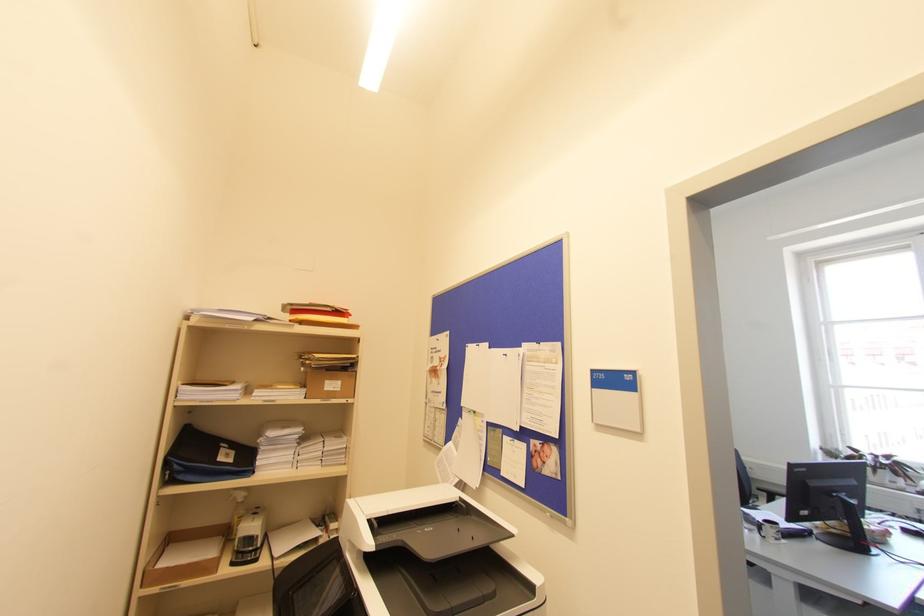
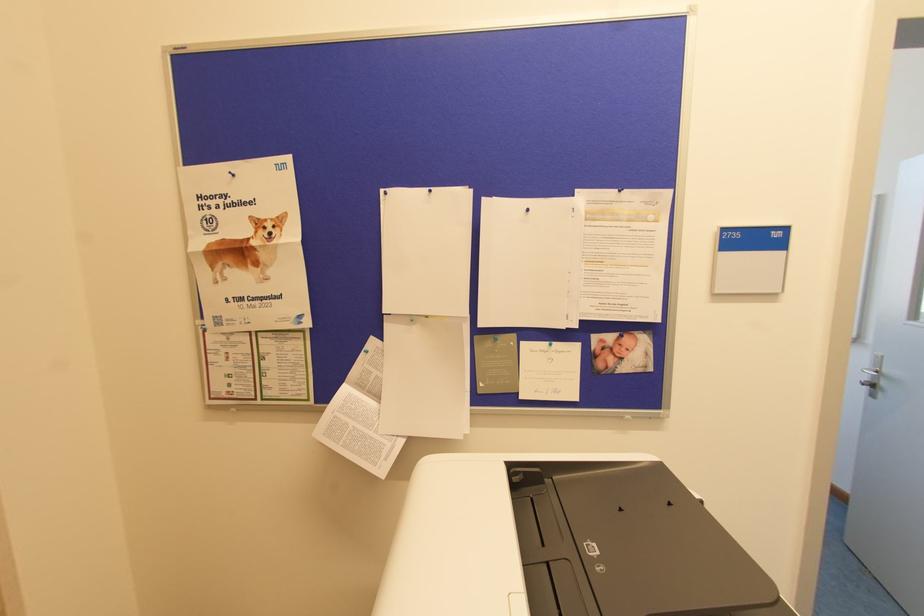
In the second image, find the point that corresponds to [473,488] in the first image.

(460, 438)